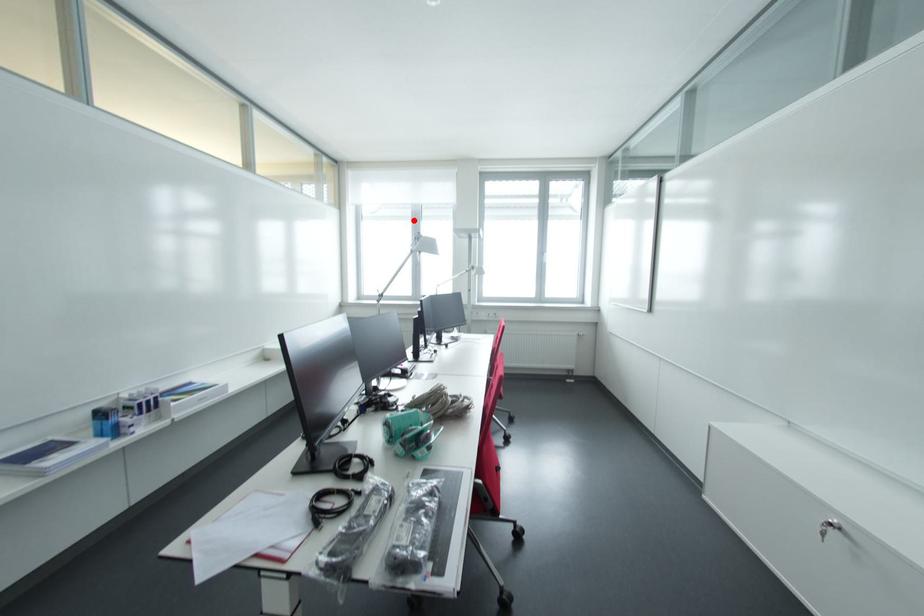
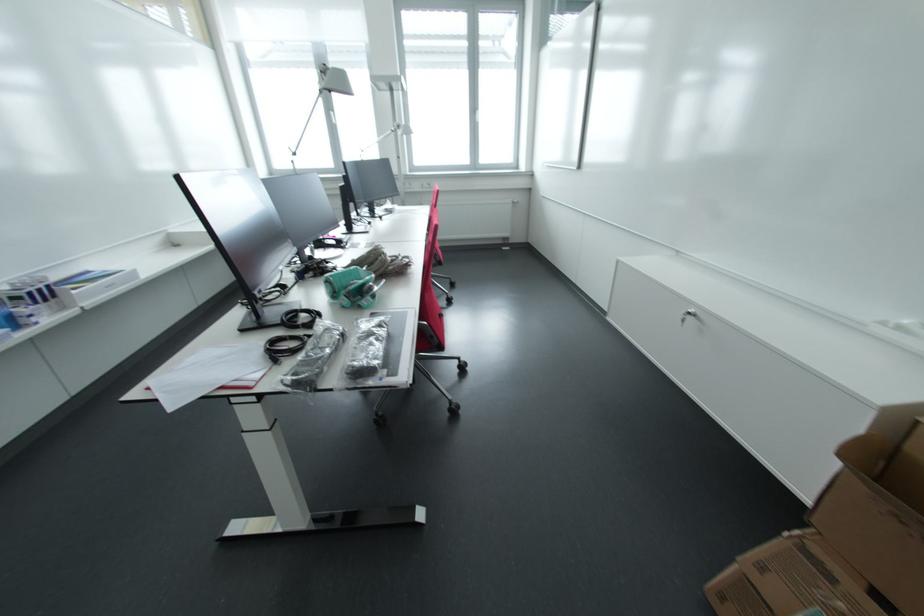
The point at the highlighted location is marked in the first image. Where is the corresponding point in the second image?

(319, 67)